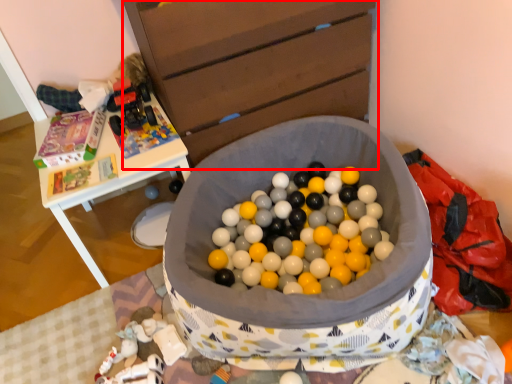
Question: Considering the relative positions of chest of drawers (annotated by the red box) and table in the image provided, where is chest of drawers (annotated by the red box) located with respect to the staircase?

Choices:
 (A) left
 (B) right

Answer: (B)